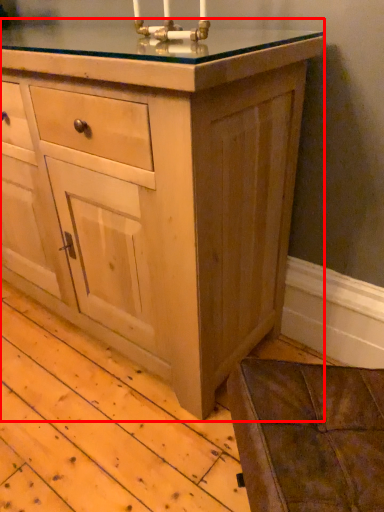
Question: From the image's perspective, what is the correct spatial relationship of chest of drawers (annotated by the red box) in relation to candle holder?

Choices:
 (A) below
 (B) above

Answer: (A)